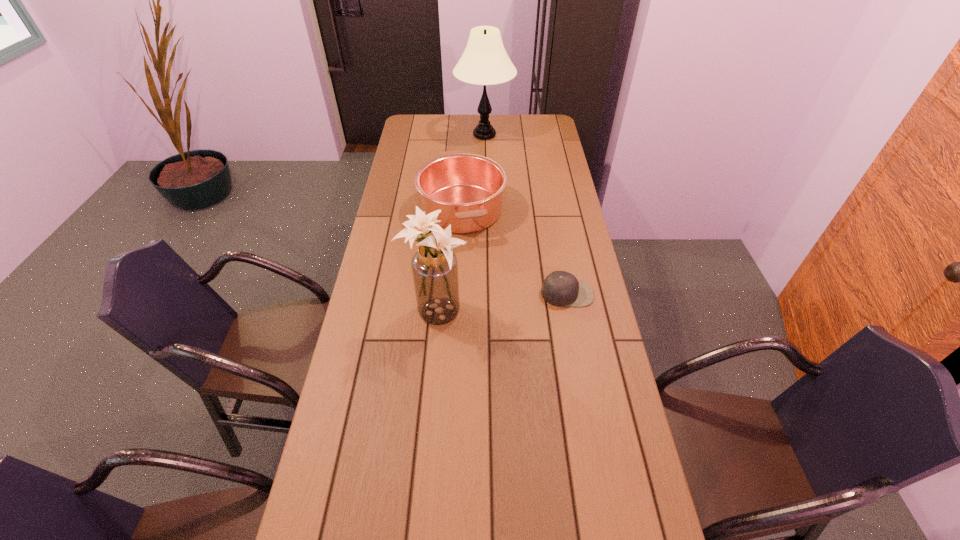
Where is `free point between the shortest object and the flower arrangement`? The width and height of the screenshot is (960, 540). free point between the shortest object and the flower arrangement is located at coordinates (501, 303).

You are a GUI agent. You are given a task and a screenshot of the screen. Output one action in this format:
    pyautogui.click(x=<x>, y=<y>)
    Task: Click on the free space that is in between the shortest object and the flower arrangement
    This screenshot has height=540, width=960.
    Given the screenshot: What is the action you would take?
    pyautogui.click(x=501, y=303)

Where is `vacant area that lies between the rightmost object and the third tallest object`? The width and height of the screenshot is (960, 540). vacant area that lies between the rightmost object and the third tallest object is located at coordinates (515, 251).

Identify which object is the nearest to the rightmost object. Please provide its 2D coordinates. Your answer should be formatted as a tuple, i.e. [(x, y)], where the tuple contains the x and y coordinates of a point satisfying the conditions above.

[(468, 189)]

Locate which object is the second closest to the saucepan. Please provide its 2D coordinates. Your answer should be formatted as a tuple, i.e. [(x, y)], where the tuple contains the x and y coordinates of a point satisfying the conditions above.

[(434, 266)]

Locate an element on the screen. vacant region that satisfies the following two spatial constraints: 1. on the back side of the second tallest object; 2. on the right side of the second farthest object is located at coordinates (445, 209).

Locate an element on the screen. The image size is (960, 540). free space that satisfies the following two spatial constraints: 1. on the back side of the second shortest object; 2. on the left side of the farthest object is located at coordinates coord(466,135).